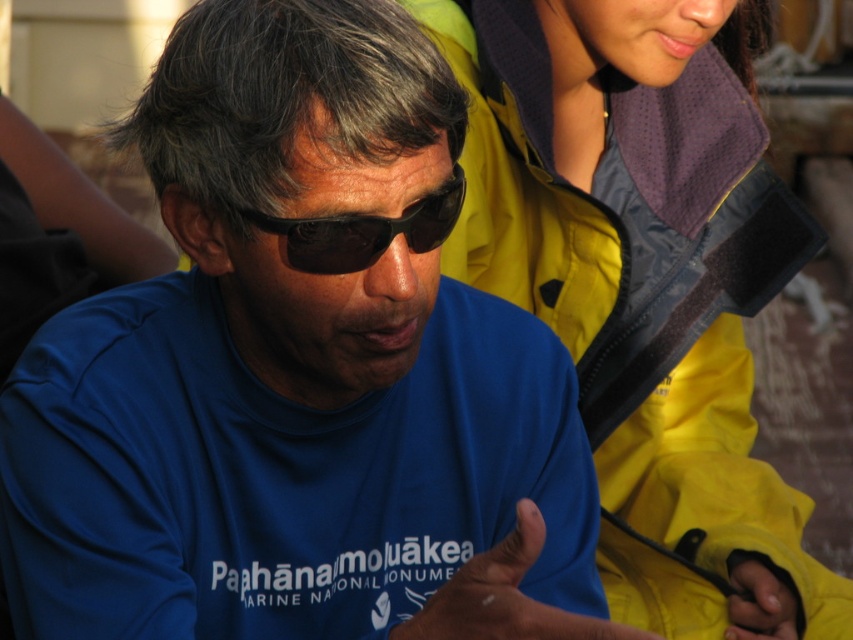
You are a photographer trying to capture a candid shot of the yellow fabric hand at lower right without including the yellow waterproof jacket at upper right in the frame. Is this possible given their positions?

Result: The yellow waterproof jacket at upper right is further to the viewer than the yellow fabric hand at lower right, so it might block the view of the hand. Adjust your angle to avoid the jacket and focus on the hand.

You are a photographer trying to capture a closeup of the black plastic goggles at center. You notice a yellow fabric hand at lower right in your frame. Based on the scene, can you determine if the hand is blocking the view of the goggles?

The black plastic goggles at center is above the yellow fabric hand at lower right, so the hand is below the goggles and not blocking the view.

You are standing in front of the two people in the image. You want to place a small gift between the two points labeled as point (415, 634) and point (260, 221). Which point should the gift be closer to so it is nearer to the person facing you?

The gift should be placed closer to point (415, 634) because it is closer to the viewer than point (260, 221).